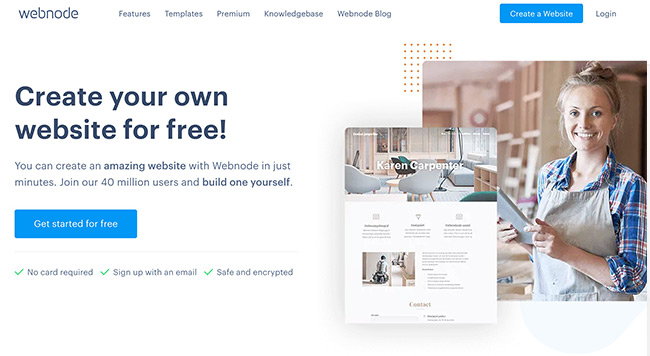
This screenshot has width=650, height=356. I want to click on green chair, so click(480, 196), click(402, 159).